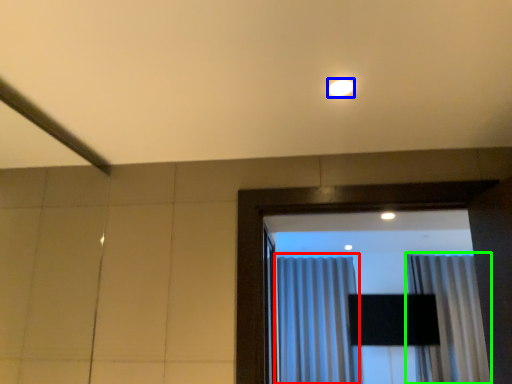
Question: Which object is positioned closest to curtain (highlighted by a red box)? Select from lighting (highlighted by a blue box) and curtain (highlighted by a green box).

Choices:
 (A) lighting
 (B) curtain

Answer: (B)